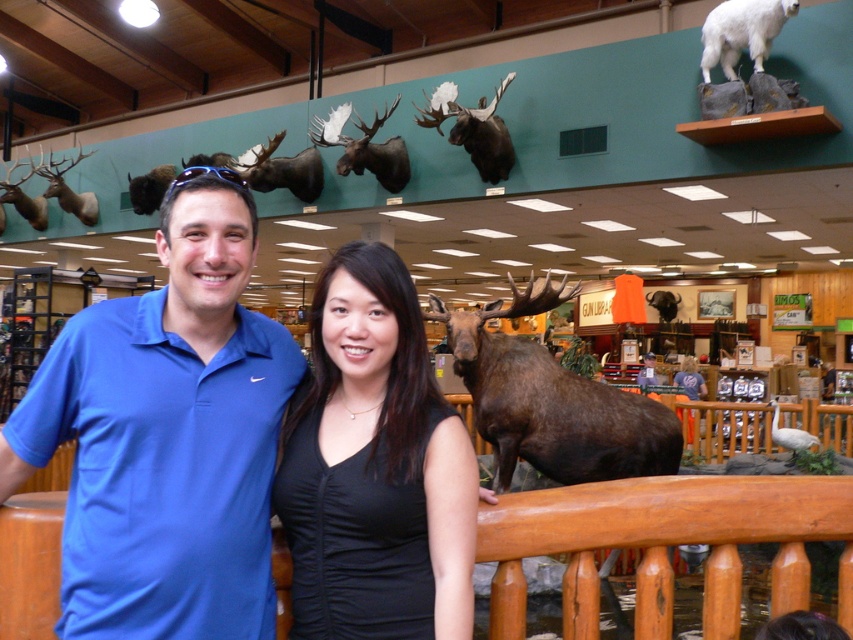
Question: Can you confirm if shiny brown moose head at center is positioned above brown velvet moose at center?

Choices:
 (A) no
 (B) yes

Answer: (B)

Question: Among these points, which one is farthest from the camera?

Choices:
 (A) (270, 157)
 (B) (387, 115)
 (C) (544, 474)
 (D) (799, 445)

Answer: (A)

Question: Which point appears closest to the camera in this image?

Choices:
 (A) (711, 58)
 (B) (810, 444)

Answer: (B)

Question: Is brown matte moose at center bigger than brown velvet moose at center?

Choices:
 (A) no
 (B) yes

Answer: (B)

Question: Among these points, which one is farthest from the camera?

Choices:
 (A) (587, 390)
 (B) (809, 436)
 (C) (125, 381)
 (D) (306, 536)

Answer: (B)

Question: Is brown matte moose at center wider than brown matte moose head at upper center?

Choices:
 (A) no
 (B) yes

Answer: (B)